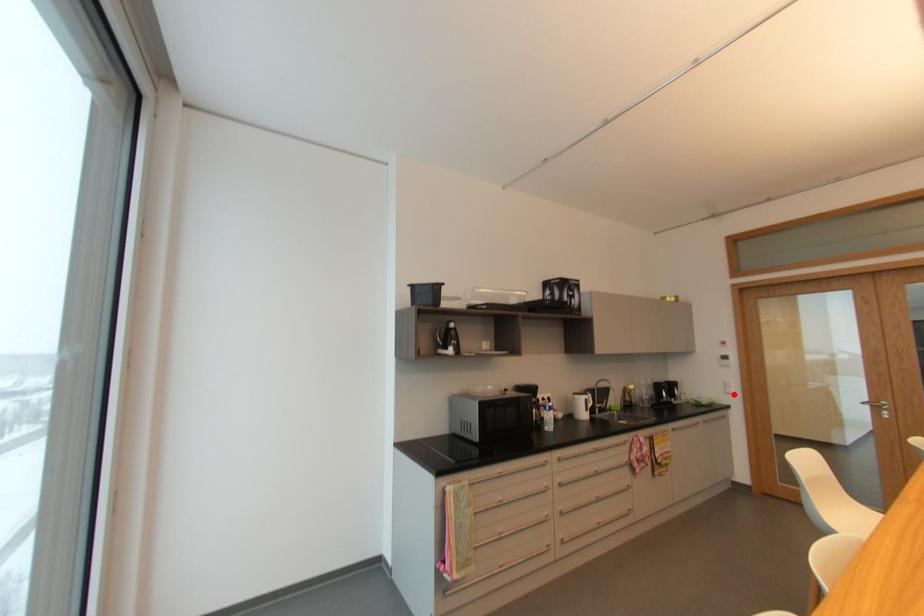
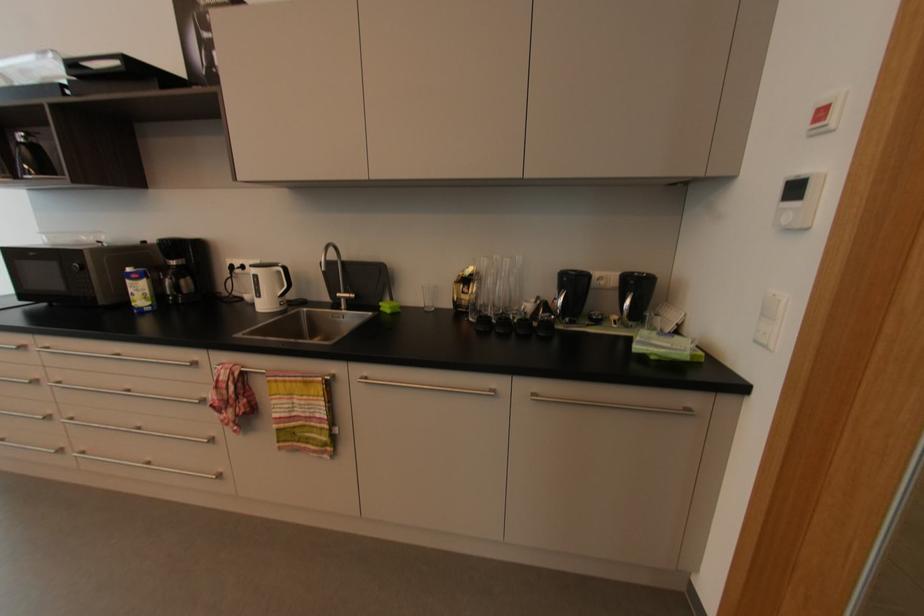
Where in the second image is the point corresponding to the highlighted location from the first image?

(769, 347)